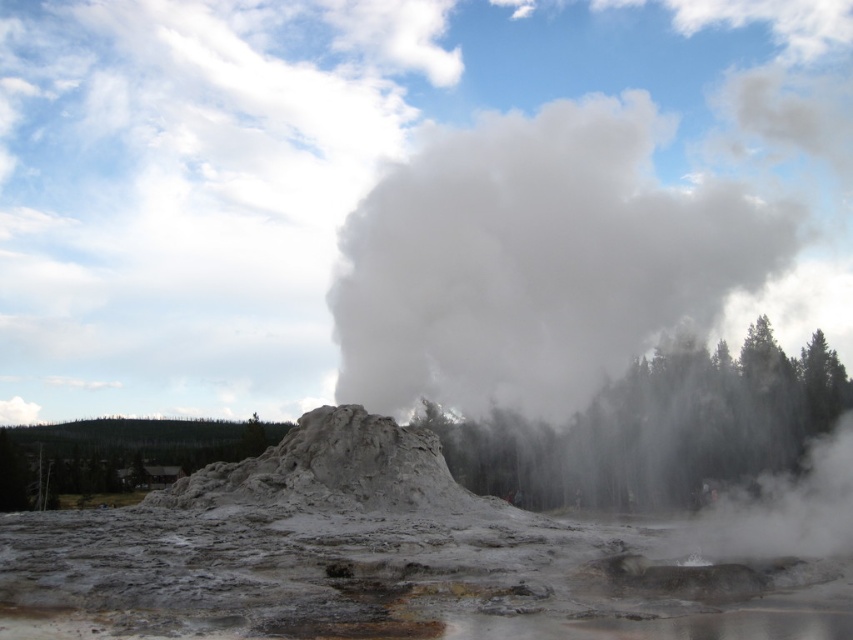
Question: Does white steam at center appear over white vapor at center?

Choices:
 (A) yes
 (B) no

Answer: (A)

Question: Is white vapor at center thinner than gray mud volcano at center?

Choices:
 (A) yes
 (B) no

Answer: (B)

Question: Which object is farther from the camera taking this photo?

Choices:
 (A) white steam at center
 (B) gray mud volcano at center

Answer: (A)

Question: Can you confirm if white steam at center is thinner than gray mud volcano at center?

Choices:
 (A) yes
 (B) no

Answer: (B)

Question: Which object appears farthest from the camera in this image?

Choices:
 (A) white vapor at center
 (B) white steam at center
 (C) gray mud volcano at center

Answer: (B)

Question: Which point is farther to the camera?

Choices:
 (A) (489, 260)
 (B) (386, 497)

Answer: (A)